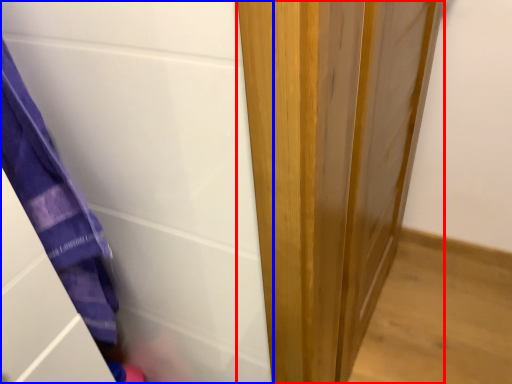
Question: Which of the following is the farthest to the observer, door (highlighted by a red box) or screen door (highlighted by a blue box)?

Choices:
 (A) door
 (B) screen door

Answer: (A)